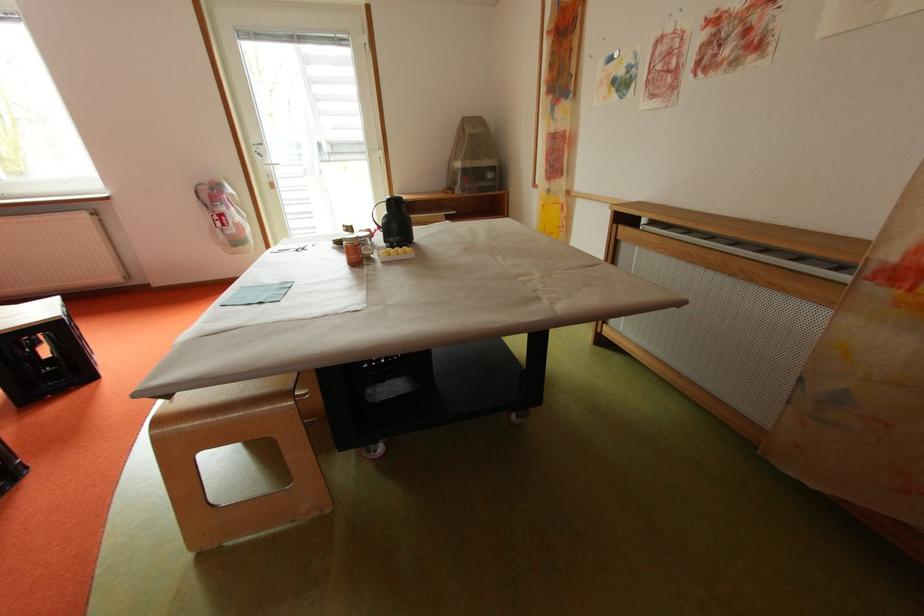
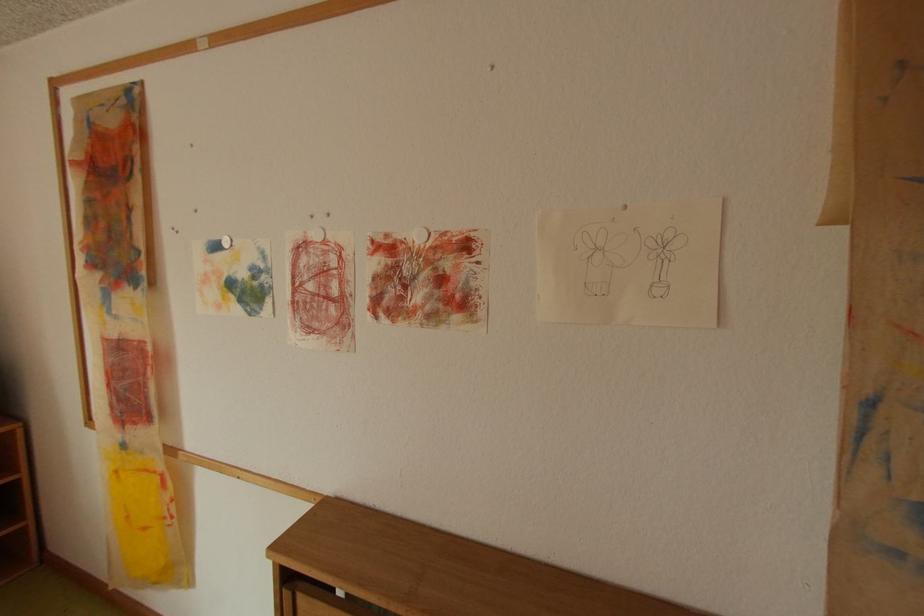
Locate, in the second image, the point that corresponds to (625,95) in the first image.

(247, 309)